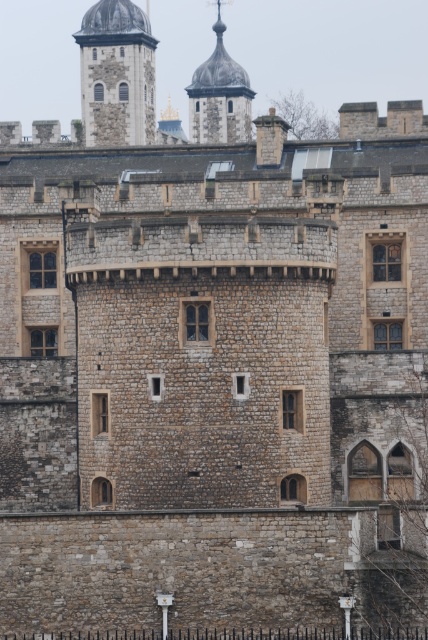
Question: Can you confirm if stone dome at upper left is wider than smooth stone dome at upper center?

Choices:
 (A) yes
 (B) no

Answer: (B)

Question: Does stone dome at upper left come in front of smooth stone dome at upper center?

Choices:
 (A) yes
 (B) no

Answer: (A)

Question: Among these points, which one is farthest from the camera?

Choices:
 (A) (86, 70)
 (B) (199, 131)

Answer: (B)

Question: Which point is closer to the camera?

Choices:
 (A) stone dome at upper left
 (B) smooth stone dome at upper center

Answer: (A)

Question: Can you confirm if stone dome at upper left is bigger than smooth stone dome at upper center?

Choices:
 (A) yes
 (B) no

Answer: (B)